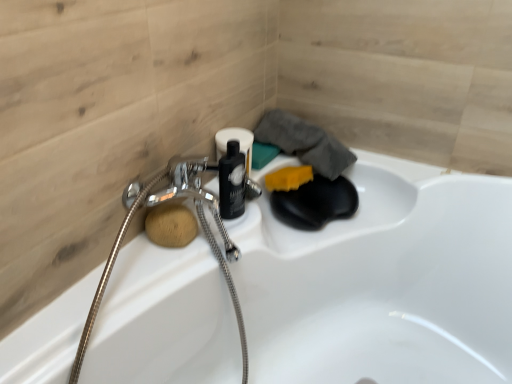
Locate an element on the screen. yellow sponge at upper right, positioned as the second soap in front-to-back order is located at coordinates (288, 178).

Which object is positioned more to the left, wooden sponge at lower left, which ranks as the second soap in top-to-bottom order, or yellow sponge at upper right, acting as the first soap starting from the back?

wooden sponge at lower left, which ranks as the second soap in top-to-bottom order.

Is wooden sponge at lower left, which is the 1th soap in bottom-to-top order, inside or outside of yellow sponge at upper right, the first soap in the right-to-left sequence?

wooden sponge at lower left, which is the 1th soap in bottom-to-top order, is outside yellow sponge at upper right, the first soap in the right-to-left sequence.

Which object is wider, wooden sponge at lower left, which ranks as the second soap in top-to-bottom order, or yellow sponge at upper right, placed as the first soap when sorted from top to bottom?

With larger width is yellow sponge at upper right, placed as the first soap when sorted from top to bottom.

From a real-world perspective, who is located lower, wooden sponge at lower left, marked as the first soap in a left-to-right arrangement, or yellow sponge at upper right, the first soap in the right-to-left sequence?

yellow sponge at upper right, the first soap in the right-to-left sequence.

Which object is positioned more to the right, yellow sponge at upper right, positioned as the second soap in front-to-back order, or wooden sponge at lower left, marked as the first soap in a left-to-right arrangement?

From the viewer's perspective, yellow sponge at upper right, positioned as the second soap in front-to-back order, appears more on the right side.

Can you confirm if yellow sponge at upper right, positioned as the second soap in left-to-right order, is bigger than wooden sponge at lower left, which ranks as the second soap in top-to-bottom order?

Correct, yellow sponge at upper right, positioned as the second soap in left-to-right order, is larger in size than wooden sponge at lower left, which ranks as the second soap in top-to-bottom order.

Is yellow sponge at upper right, positioned as the second soap in front-to-back order, positioned far away from wooden sponge at lower left, which ranks as the second soap in right-to-left order?

That's not correct — yellow sponge at upper right, positioned as the second soap in front-to-back order, is a little close to wooden sponge at lower left, which ranks as the second soap in right-to-left order.

In the scene shown: Would you say yellow sponge at upper right, positioned as the second soap in front-to-back order, is outside wooden sponge at lower left, which ranks as the second soap in top-to-bottom order?

Yes.

How many degrees apart are the facing directions of yellow sponge at upper right, the second soap in the bottom-to-top sequence, and metallic silver garden hose at left?

The angle between the facing direction of yellow sponge at upper right, the second soap in the bottom-to-top sequence, and the facing direction of metallic silver garden hose at left is 0.061 degrees.

How far apart are yellow sponge at upper right, positioned as the second soap in front-to-back order, and metallic silver garden hose at left?

They are 12.32 inches apart.

Are yellow sponge at upper right, positioned as the second soap in left-to-right order, and metallic silver garden hose at left far apart?

They are positioned close to each other.

Is yellow sponge at upper right, placed as the first soap when sorted from top to bottom, positioned with its back to metallic silver garden hose at left?

No, metallic silver garden hose at left is not at the back of yellow sponge at upper right, placed as the first soap when sorted from top to bottom.

Can you confirm if metallic silver garden hose at left is shorter than wooden sponge at lower left, which is the 1th soap in bottom-to-top order?

No.

Which is more to the right, metallic silver garden hose at left or wooden sponge at lower left, which is the 1th soap in bottom-to-top order?

metallic silver garden hose at left.

What are the coordinates of `garden hose that is in front of the wooden sponge at lower left, which ranks as the 2th soap in back-to-front order` in the screenshot? It's located at (201, 225).

Is metallic silver garden hose at left facing towards wooden sponge at lower left, the first soap viewed from the front?

Yes, metallic silver garden hose at left is aimed at wooden sponge at lower left, the first soap viewed from the front.

Between metallic silver garden hose at left and yellow sponge at upper right, the first soap in the right-to-left sequence, which one appears on the right side from the viewer's perspective?

yellow sponge at upper right, the first soap in the right-to-left sequence, is more to the right.

Is metallic silver garden hose at left positioned before yellow sponge at upper right, positioned as the second soap in front-to-back order?

That is True.

From the image's perspective, is metallic silver garden hose at left above or below yellow sponge at upper right, the first soap in the right-to-left sequence?

Clearly, from the image's perspective, metallic silver garden hose at left is below yellow sponge at upper right, the first soap in the right-to-left sequence.

Consider the image. Which object is positioned more to the left, wooden sponge at lower left, which ranks as the second soap in top-to-bottom order, or metallic silver garden hose at left?

wooden sponge at lower left, which ranks as the second soap in top-to-bottom order.

Does point (187, 229) appear closer or farther from the camera than point (186, 166)?

Point (187, 229) appears to be closer to the viewer than point (186, 166).

From the image's perspective, which object appears higher, wooden sponge at lower left, which ranks as the second soap in right-to-left order, or metallic silver garden hose at left?

wooden sponge at lower left, which ranks as the second soap in right-to-left order, is shown above in the image.

Identify the location of soap that appears in front of the yellow sponge at upper right, the first soap in the right-to-left sequence. The width and height of the screenshot is (512, 384). (170, 225).

Locate an element on the screen. This screenshot has width=512, height=384. soap below the wooden sponge at lower left, which ranks as the second soap in top-to-bottom order (from a real-world perspective) is located at coordinates (288, 178).

Considering their positions, is metallic silver garden hose at left positioned closer to yellow sponge at upper right, positioned as the second soap in front-to-back order, than wooden sponge at lower left, which ranks as the second soap in right-to-left order?

metallic silver garden hose at left lies closer to yellow sponge at upper right, positioned as the second soap in front-to-back order, than the other object.

Based on their spatial positions, is wooden sponge at lower left, which ranks as the 2th soap in back-to-front order, or yellow sponge at upper right, acting as the first soap starting from the back, closer to metallic silver garden hose at left?

The object closer to metallic silver garden hose at left is wooden sponge at lower left, which ranks as the 2th soap in back-to-front order.

From the image, which object appears to be nearer to yellow sponge at upper right, positioned as the second soap in left-to-right order, wooden sponge at lower left, the first soap viewed from the front, or metallic silver garden hose at left?

metallic silver garden hose at left is positioned closer to the anchor yellow sponge at upper right, positioned as the second soap in left-to-right order.

Estimate the real-world distances between objects in this image. Which object is further from metallic silver garden hose at left, yellow sponge at upper right, positioned as the second soap in left-to-right order, or wooden sponge at lower left, which ranks as the second soap in right-to-left order?

The object further to metallic silver garden hose at left is yellow sponge at upper right, positioned as the second soap in left-to-right order.

Which object lies further to the anchor point wooden sponge at lower left, marked as the first soap in a left-to-right arrangement, yellow sponge at upper right, positioned as the second soap in front-to-back order, or metallic silver garden hose at left?

The object further to wooden sponge at lower left, marked as the first soap in a left-to-right arrangement, is yellow sponge at upper right, positioned as the second soap in front-to-back order.

Based on their spatial positions, is metallic silver garden hose at left or yellow sponge at upper right, the second soap in the bottom-to-top sequence, closer to wooden sponge at lower left, the first soap viewed from the front?

metallic silver garden hose at left lies closer to wooden sponge at lower left, the first soap viewed from the front, than the other object.

Where is `soap located between metallic silver garden hose at left and yellow sponge at upper right, acting as the first soap starting from the back, in the depth direction`? soap located between metallic silver garden hose at left and yellow sponge at upper right, acting as the first soap starting from the back, in the depth direction is located at coordinates coord(170,225).